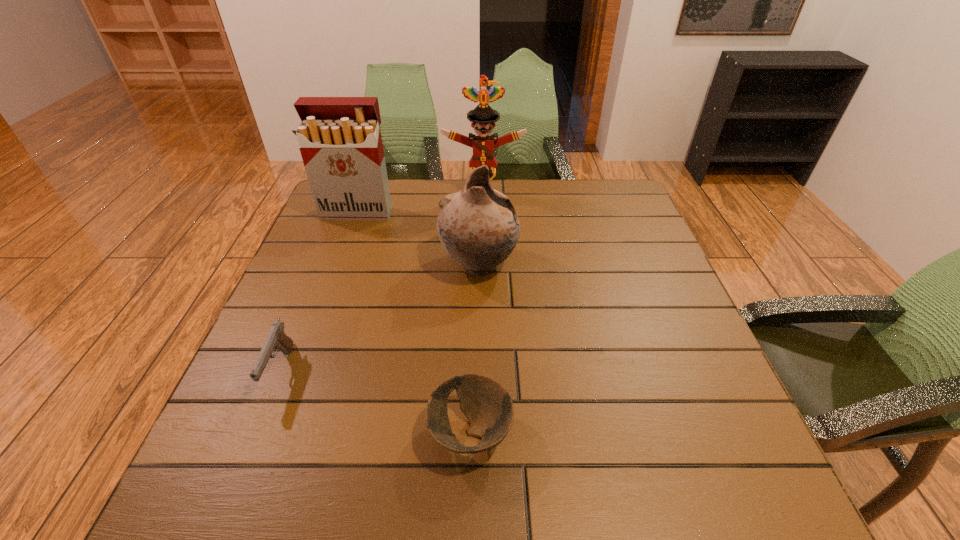
Where is `free spot between the third shortest object and the second shortest object`? free spot between the third shortest object and the second shortest object is located at coordinates (380, 318).

Where is `free space between the pistol and the nutcracker`? free space between the pistol and the nutcracker is located at coordinates [382, 283].

You are a GUI agent. You are given a task and a screenshot of the screen. Output one action in this format:
    pyautogui.click(x=<x>, y=<y>)
    Task: Click on the vacant area between the nutcracker and the second farthest object
    
    Given the screenshot: What is the action you would take?
    pyautogui.click(x=420, y=204)

Locate which object ranks fourth in proximity to the shortest object. Please provide its 2D coordinates. Your answer should be formatted as a tuple, i.e. [(x, y)], where the tuple contains the x and y coordinates of a point satisfying the conditions above.

[(483, 117)]

Select which object appears as the second closest to the bowl. Please provide its 2D coordinates. Your answer should be formatted as a tuple, i.e. [(x, y)], where the tuple contains the x and y coordinates of a point satisfying the conditions above.

[(277, 339)]

Locate an element on the screen. free space that satisfies the following two spatial constraints: 1. at the barrel of the pistol; 2. on the left side of the shortest object is located at coordinates pos(255,433).

At what (x,y) coordinates should I click in order to perform the action: click on free location that satisfies the following two spatial constraints: 1. from the spout of the pottery; 2. at the barrel of the pistol. Please return your answer as a coordinate pair (x, y). Looking at the image, I should click on 478,370.

The height and width of the screenshot is (540, 960). Identify the location of vacant region that satisfies the following two spatial constraints: 1. from the spout of the third shortest object; 2. at the barrel of the second shortest object. (478, 370).

You are a GUI agent. You are given a task and a screenshot of the screen. Output one action in this format:
    pyautogui.click(x=<x>, y=<y>)
    Task: Click on the free location that satisfies the following two spatial constraints: 1. at the barrel of the bowl; 2. on the right side of the pistol
    
    Given the screenshot: What is the action you would take?
    pyautogui.click(x=255, y=433)